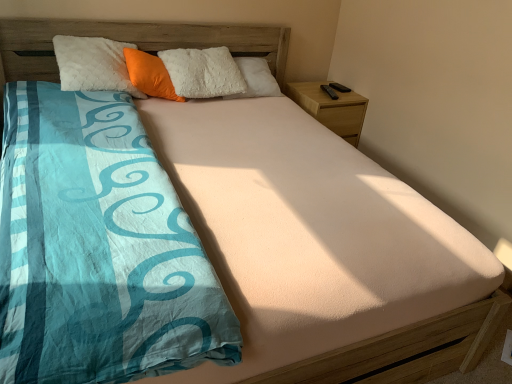
Where is `wooden nightstand at right`? Image resolution: width=512 pixels, height=384 pixels. wooden nightstand at right is located at coordinates (331, 108).

What do you see at coordinates (331, 108) in the screenshot? I see `wooden nightstand at right` at bounding box center [331, 108].

The height and width of the screenshot is (384, 512). What are the coordinates of `orange plush pillow at upper center` in the screenshot? It's located at (150, 75).

The height and width of the screenshot is (384, 512). Describe the element at coordinates (150, 75) in the screenshot. I see `orange plush pillow at upper center` at that location.

Measure the distance between point (149,55) and camera.

A distance of 2.46 meters exists between point (149,55) and camera.

The height and width of the screenshot is (384, 512). Identify the location of wooden nightstand at right. (331, 108).

Does wooden nightstand at right appear on the left side of orange plush pillow at upper center?

In fact, wooden nightstand at right is to the right of orange plush pillow at upper center.

Is wooden nightstand at right in front of or behind orange plush pillow at upper center in the image?

Clearly, wooden nightstand at right is behind orange plush pillow at upper center.

Which point is more forward, (357, 102) or (160, 76)?

Point (160, 76)

From the image's perspective, is wooden nightstand at right below orange plush pillow at upper center?

Yes.

From a real-world perspective, is wooden nightstand at right positioned over orange plush pillow at upper center based on gravity?

No, from a real-world perspective, wooden nightstand at right is not over orange plush pillow at upper center

Considering the relative sizes of wooden nightstand at right and orange plush pillow at upper center in the image provided, is wooden nightstand at right wider than orange plush pillow at upper center?

Indeed, wooden nightstand at right has a greater width compared to orange plush pillow at upper center.

Considering the relative sizes of wooden nightstand at right and orange plush pillow at upper center in the image provided, is wooden nightstand at right taller than orange plush pillow at upper center?

Yes.

Considering the sizes of objects wooden nightstand at right and orange plush pillow at upper center in the image provided, who is smaller, wooden nightstand at right or orange plush pillow at upper center?

With smaller size is orange plush pillow at upper center.

Do you think wooden nightstand at right is within orange plush pillow at upper center, or outside of it?

The correct answer is: outside.

Is wooden nightstand at right far from orange plush pillow at upper center?

No.

Could you tell me if wooden nightstand at right is turned towards orange plush pillow at upper center?

No.

Where is `pillow above the wooden nightstand at right (from a real-world perspective)`? The height and width of the screenshot is (384, 512). pillow above the wooden nightstand at right (from a real-world perspective) is located at coordinates (150, 75).

Is orange plush pillow at upper center at the left side of wooden nightstand at right?

Indeed, orange plush pillow at upper center is positioned on the left side of wooden nightstand at right.

Who is more distant, orange plush pillow at upper center or wooden nightstand at right?

wooden nightstand at right is further away from the camera.

Is point (139, 55) positioned in front of point (330, 99)?

That is True.

From the image's perspective, is orange plush pillow at upper center under wooden nightstand at right?

Incorrect, from the image's perspective, orange plush pillow at upper center is higher than wooden nightstand at right.

From a real-world perspective, which is physically below, orange plush pillow at upper center or wooden nightstand at right?

wooden nightstand at right is physically lower.

Which object is wider, orange plush pillow at upper center or wooden nightstand at right?

wooden nightstand at right.

Can you confirm if orange plush pillow at upper center is taller than wooden nightstand at right?

No, orange plush pillow at upper center is not taller than wooden nightstand at right.

Between orange plush pillow at upper center and wooden nightstand at right, which one has larger size?

wooden nightstand at right is bigger.

Could wooden nightstand at right be considered to be inside orange plush pillow at upper center?

That's incorrect, wooden nightstand at right is not inside orange plush pillow at upper center.

Are orange plush pillow at upper center and wooden nightstand at right far apart?

No.

Is orange plush pillow at upper center oriented towards wooden nightstand at right?

No, orange plush pillow at upper center is not turned towards wooden nightstand at right.

Can you tell me how much orange plush pillow at upper center and wooden nightstand at right differ in facing direction?

53.3 degrees.

At what (x,y) coordinates should I click in order to perform the action: click on nightstand on the right of orange plush pillow at upper center. Please return your answer as a coordinate pair (x, y). The image size is (512, 384). Looking at the image, I should click on (331, 108).

Where is `pillow above the wooden nightstand at right (from a real-world perspective)`? This screenshot has width=512, height=384. pillow above the wooden nightstand at right (from a real-world perspective) is located at coordinates (150, 75).

At what (x,y) coordinates should I click in order to perform the action: click on nightstand lying behind the orange plush pillow at upper center. Please return your answer as a coordinate pair (x, y). Image resolution: width=512 pixels, height=384 pixels. Looking at the image, I should click on (331, 108).